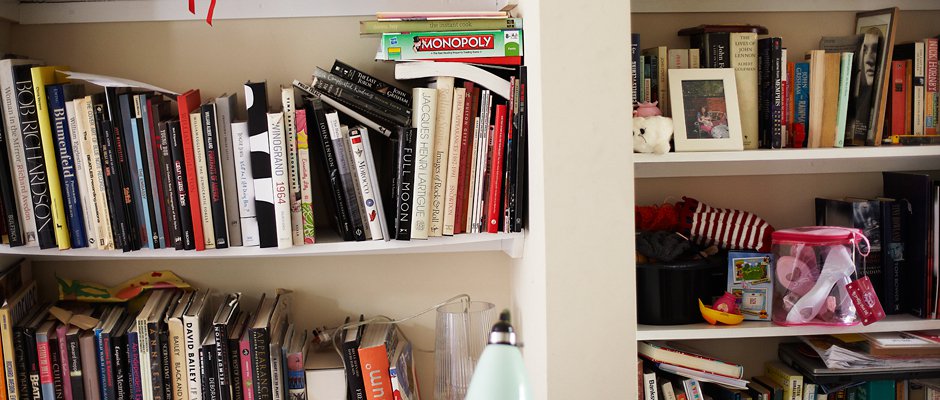
Locate an element on the screen. picture frame is located at coordinates (728, 106), (895, 12).